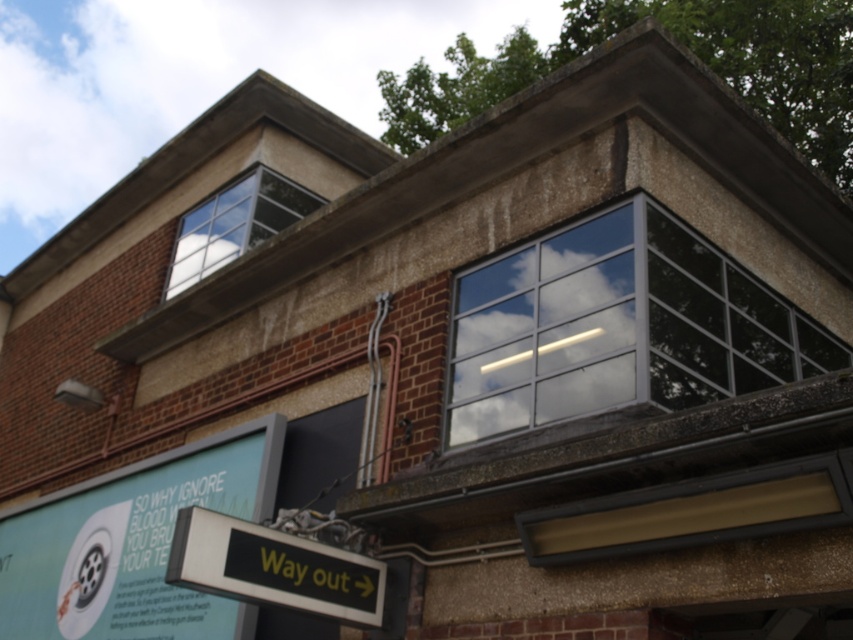
You are standing in front of the building and want to determine the relative positions of two points on its facade. The first point is located at coordinates point (654, 376), and the second at point (270, 531). Which point is closer to you?

Point (654, 376) is closer to you because it is further to the viewer than point (270, 531).

Looking at this image, you are standing in front of the building shown in the image. There is a clear glass window at upper right marked by point (618, 326). How would you describe the location of this window relative to the signboard on the left side of the building?

The clear glass window at upper right marked by point (618, 326) is located to the right of the signboard on the left side of the building.